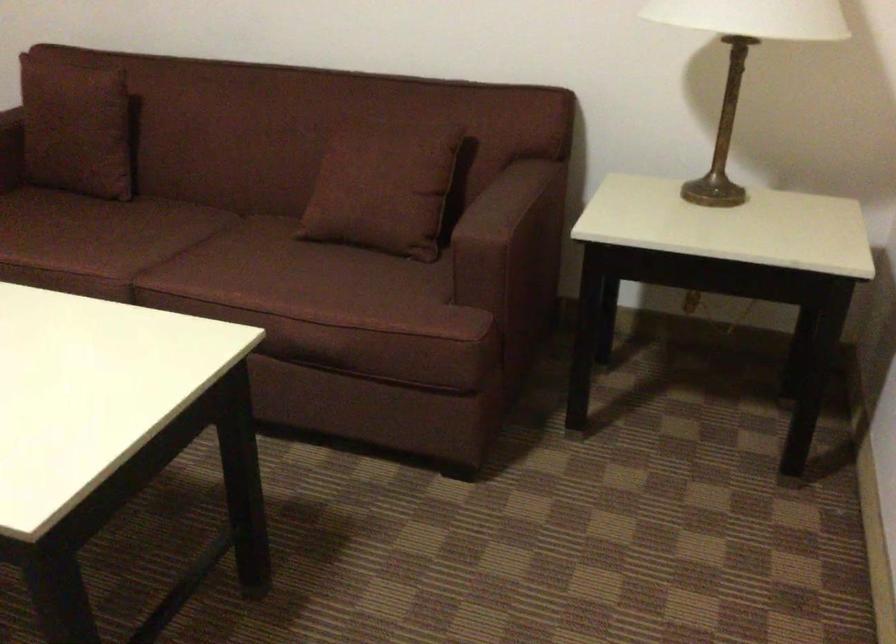
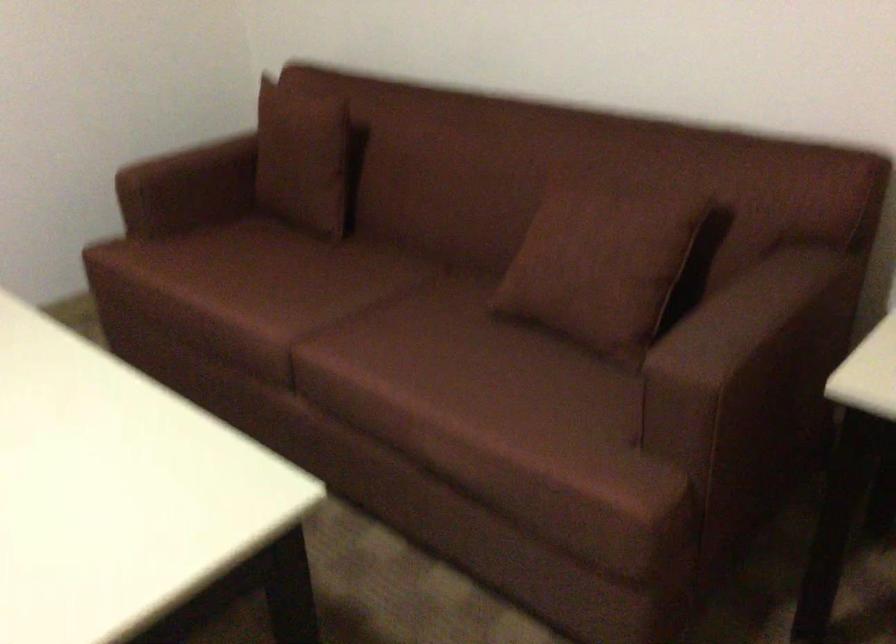
Question: Based on the continuous images, in which direction is the camera rotating? Reply with the corresponding letter.

Choices:
 (A) Left
 (B) Right
 (C) Up
 (D) Down

Answer: (A)